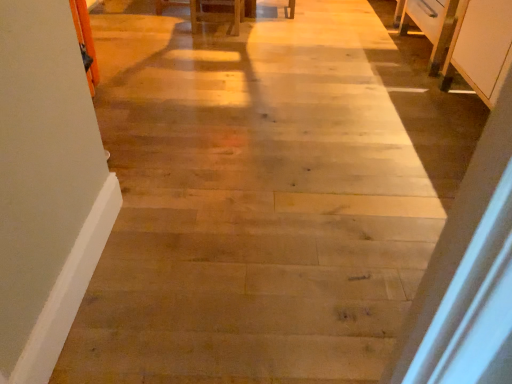
What do you see at coordinates (480, 47) in the screenshot? I see `white matte cabinet at right` at bounding box center [480, 47].

Identify the location of white matte cabinet at right. This screenshot has width=512, height=384. (480, 47).

The width and height of the screenshot is (512, 384). I want to click on white matte cabinet at right, so click(480, 47).